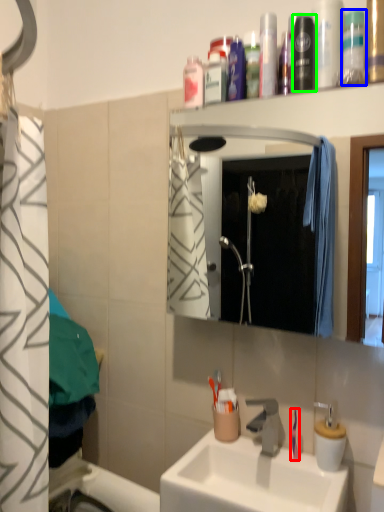
Question: Which object is positioned farthest from toothbrush (highlighted by a red box)? Select from mouthwash (highlighted by a blue box) and mouthwash (highlighted by a green box).

Choices:
 (A) mouthwash
 (B) mouthwash

Answer: (A)